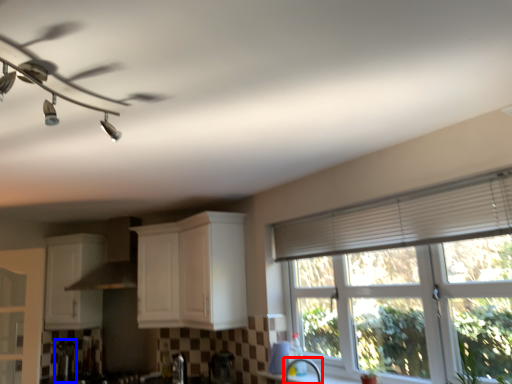
Question: Which object appears closest to the camera in this image, faucet (highlighted by a red box) or appliance (highlighted by a blue box)?

Choices:
 (A) faucet
 (B) appliance

Answer: (A)